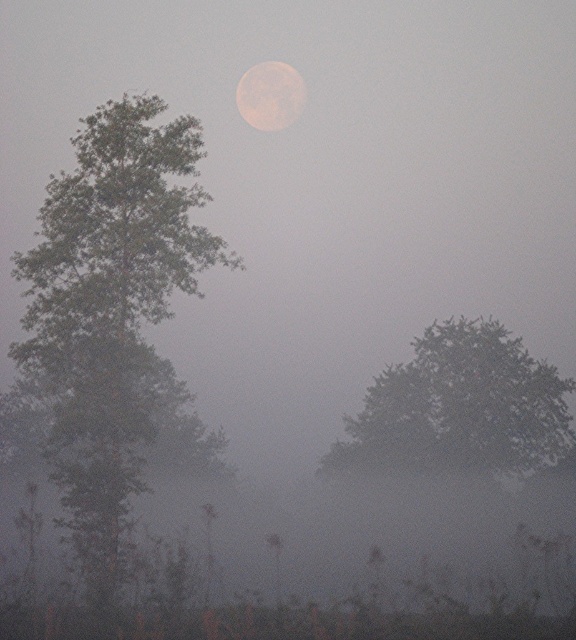
Which is more to the left, green matte tree at center or smooth gray moon at upper center?

smooth gray moon at upper center is more to the left.

Which is in front, point (457, 355) or point (276, 115)?

Point (457, 355) is more forward.

Is point (374, 428) positioned in front of point (270, 90)?

Yes, it is in front of point (270, 90).

At what (x,y) coordinates should I click in order to perform the action: click on green matte tree at center. Please return your answer as a coordinate pair (x, y). This screenshot has width=576, height=640. Looking at the image, I should click on (458, 408).

Is point (154, 128) positioned in front of point (552, 444)?

Yes, point (154, 128) is in front of point (552, 444).

Is point (88, 500) closer to viewer compared to point (471, 342)?

That is True.

This screenshot has width=576, height=640. In order to click on green leafy tree at left in this screenshot , I will do [x=111, y=310].

Based on the photo, between green leafy tree at left and smooth gray moon at upper center, which one has less height?

With less height is green leafy tree at left.

Does green leafy tree at left appear over smooth gray moon at upper center?

Actually, green leafy tree at left is below smooth gray moon at upper center.

The height and width of the screenshot is (640, 576). Describe the element at coordinates (111, 310) in the screenshot. I see `green leafy tree at left` at that location.

The height and width of the screenshot is (640, 576). I want to click on green leafy tree at left, so click(x=111, y=310).